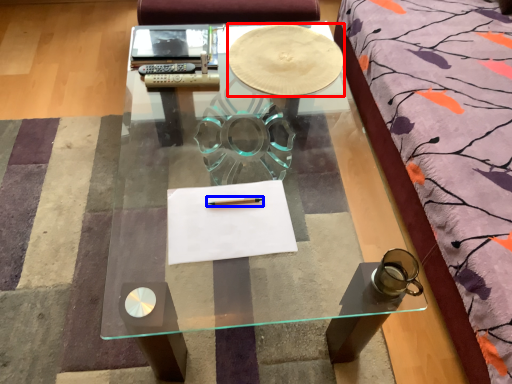
Question: Which point is closer to the camera, round table (highlighted by a red box) or pencil (highlighted by a blue box)?

Choices:
 (A) round table
 (B) pencil

Answer: (B)